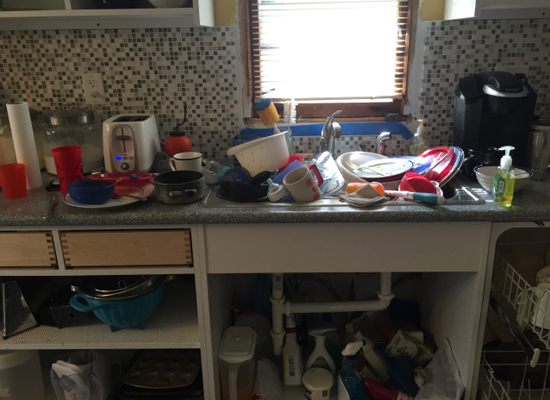
You are a GUI agent. You are given a task and a screenshot of the screen. Output one action in this format:
    pyautogui.click(x=<x>, y=<y>)
    Task: Click on the canister
    Image resolution: width=550 pixels, height=400 pixels.
    Given the screenshot: What is the action you would take?
    point(60,136), point(8,146), point(547,153)